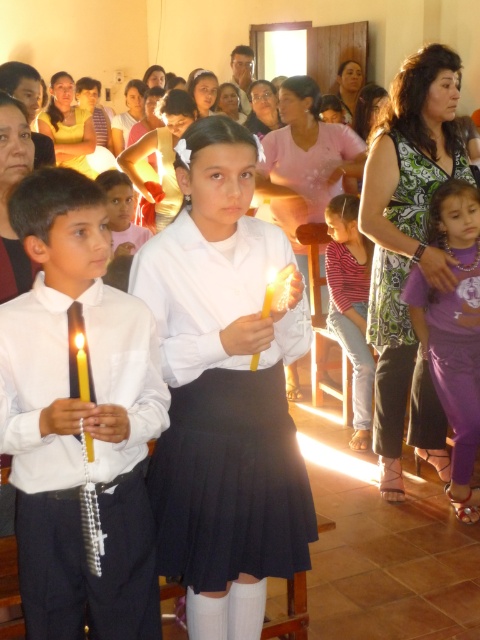
Who is positioned more to the left, purple satin dress at lower right or yellow wax candle at center?

Positioned to the left is yellow wax candle at center.

Is purple satin dress at lower right behind yellow wax candle at center?

Yes.

What do you see at coordinates (454, 332) in the screenshot? I see `purple satin dress at lower right` at bounding box center [454, 332].

Locate an element on the screen. purple satin dress at lower right is located at coordinates (454, 332).

Does striped fabric shirt at center have a greater width compared to yellow wax candle at center?

Correct, the width of striped fabric shirt at center exceeds that of yellow wax candle at center.

Which is behind, point (336, 248) or point (80, 333)?

The point (336, 248) is more distant.

What do you see at coordinates (350, 305) in the screenshot? Image resolution: width=480 pixels, height=640 pixels. I see `striped fabric shirt at center` at bounding box center [350, 305].

Identify the location of striped fabric shirt at center. (350, 305).

I want to click on matte white shirt at center, so click(79, 420).

Is matte white shirt at center in front of yellow wax candle at center?

Yes, matte white shirt at center is closer to the viewer.

Between point (88, 404) and point (82, 332), which one is positioned in front?

Positioned in front is point (88, 404).

Locate an element on the screen. This screenshot has width=480, height=640. matte white shirt at center is located at coordinates (79, 420).